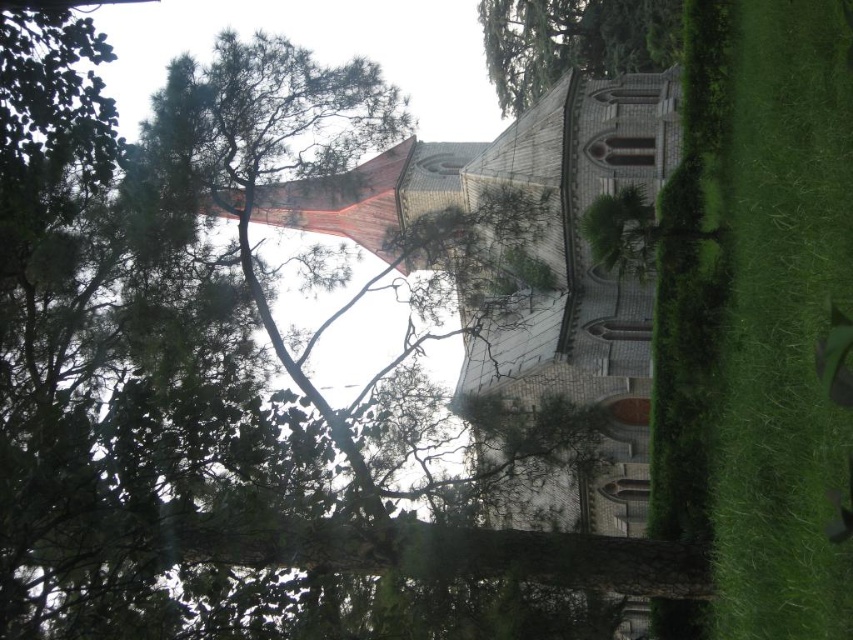
Question: Considering the relative positions of green grass at lower right and green textured tree at upper center in the image provided, where is green grass at lower right located with respect to green textured tree at upper center?

Choices:
 (A) below
 (B) above

Answer: (A)

Question: Which point is closer to the camera taking this photo?

Choices:
 (A) (500, 61)
 (B) (813, 545)

Answer: (B)

Question: Which point is closer to the camera?

Choices:
 (A) green textured tree at upper center
 (B) green grass at lower right

Answer: (B)

Question: Can you confirm if green grass at lower right is positioned to the right of green textured tree at upper center?

Choices:
 (A) yes
 (B) no

Answer: (A)

Question: Which point is closer to the camera?

Choices:
 (A) green textured tree at upper center
 (B) green grass at lower right

Answer: (B)

Question: Is green grass at lower right to the left of green textured tree at upper center from the viewer's perspective?

Choices:
 (A) yes
 (B) no

Answer: (B)